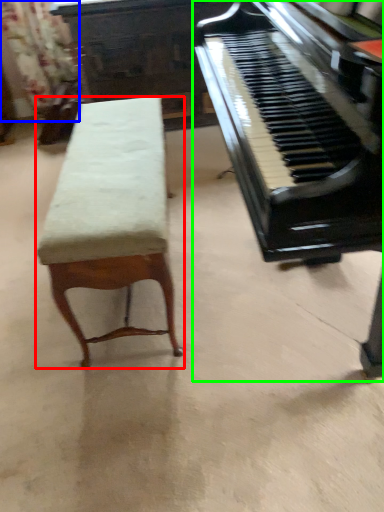
Question: Estimate the real-world distances between objects in this image. Which object is closer to furniture (highlighted by a red box), curtain (highlighted by a blue box) or piano (highlighted by a green box)?

Choices:
 (A) curtain
 (B) piano

Answer: (B)